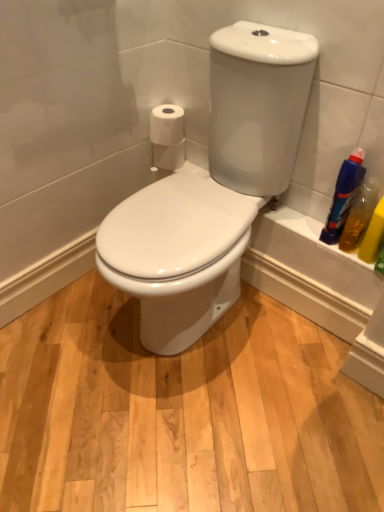
Question: Based on their positions, is white matte toilet paper at upper right, the second toilet paper positioned from the bottom, located to the left or right of white glossy toilet at center?

Choices:
 (A) left
 (B) right

Answer: (A)

Question: In terms of height, does white matte toilet paper at upper right, positioned as the 1th toilet paper in top-to-bottom order, look taller or shorter compared to white glossy toilet at center?

Choices:
 (A) short
 (B) tall

Answer: (A)

Question: Which of these objects is positioned closest to the white glossy toilet at center?

Choices:
 (A) yellow translucent bottle at right, acting as the second cleaning product starting from the left
 (B) white matte toilet paper at upper left, arranged as the second toilet paper when viewed from the top
 (C) blue plastic bottle at right, the second cleaning product in the right-to-left sequence
 (D) white matte toilet paper at upper right, positioned as the 1th toilet paper in top-to-bottom order

Answer: (C)

Question: Which object is positioned closest to the white matte toilet paper at upper right, the second toilet paper positioned from the bottom?

Choices:
 (A) yellow translucent bottle at right, acting as the second cleaning product starting from the left
 (B) white glossy toilet at center
 (C) blue plastic bottle at right, placed as the first cleaning product when sorted from left to right
 (D) white matte toilet paper at upper left, which ranks as the 1th toilet paper in bottom-to-top order

Answer: (D)